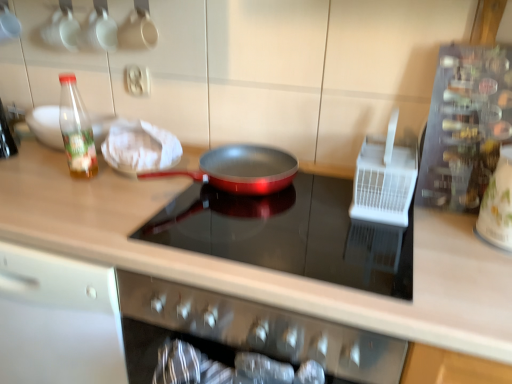
Where is `space that is in front of metallic silver spice rack at right, placed as the second appliance when sorted from left to right`? This screenshot has width=512, height=384. space that is in front of metallic silver spice rack at right, placed as the second appliance when sorted from left to right is located at coordinates (455, 237).